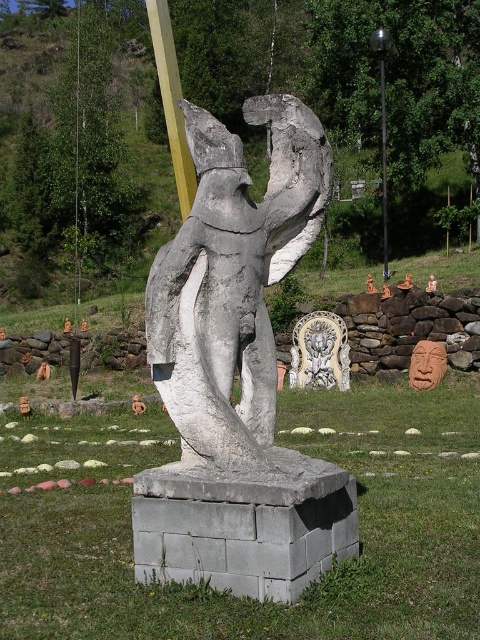
Who is higher up, gray concrete statue at center or metallic pole at upper center?

metallic pole at upper center

Is point (303, 227) positioned behind point (384, 124)?

No, it is not.

The height and width of the screenshot is (640, 480). Identify the location of gray concrete statue at center. coord(232,282).